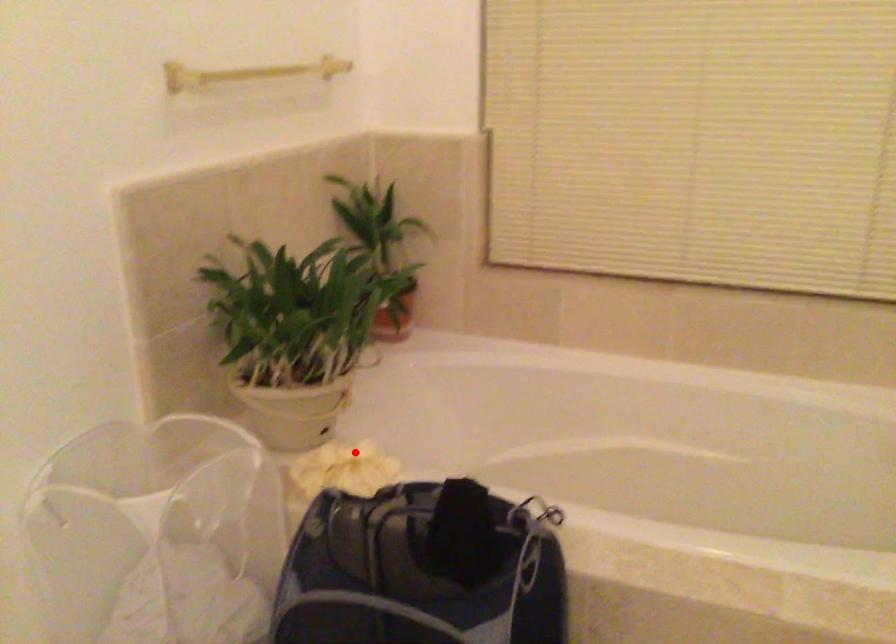
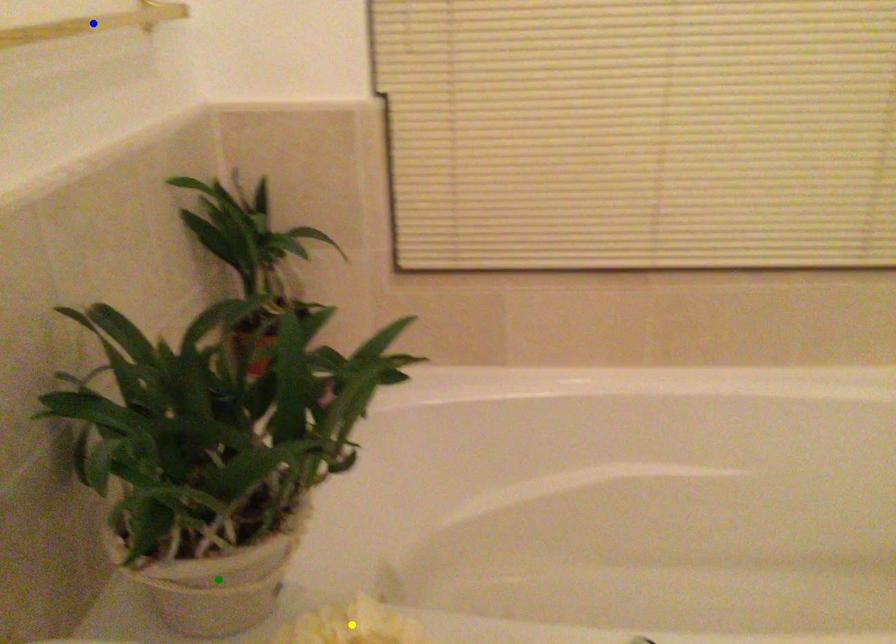
Question: I am providing you with two images of the same scene from different viewpoints. A red point is marked on the first image. You are given multiple points on the second image. Which spot in image 2 lines up with the point in image 1?

Choices:
 (A) blue point
 (B) yellow point
 (C) green point

Answer: (B)